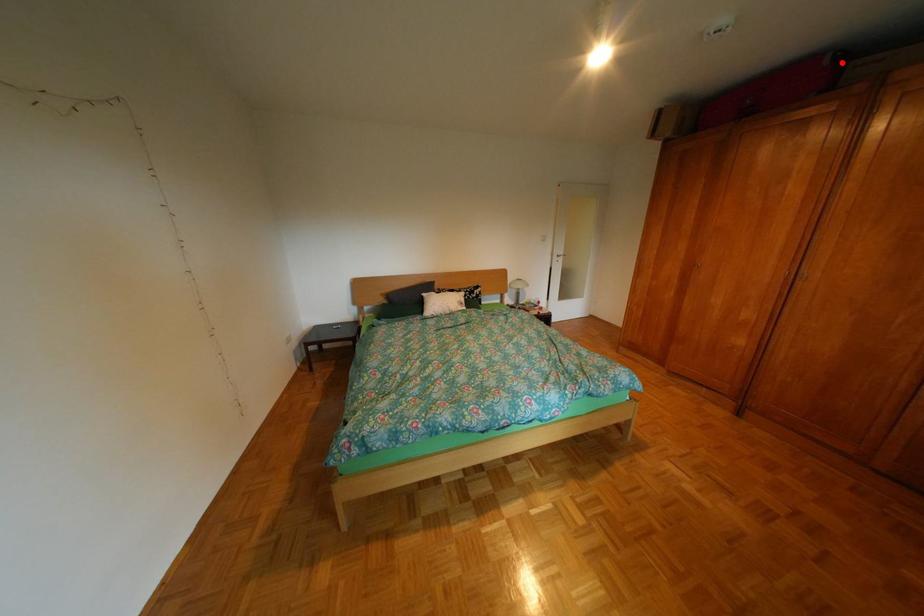
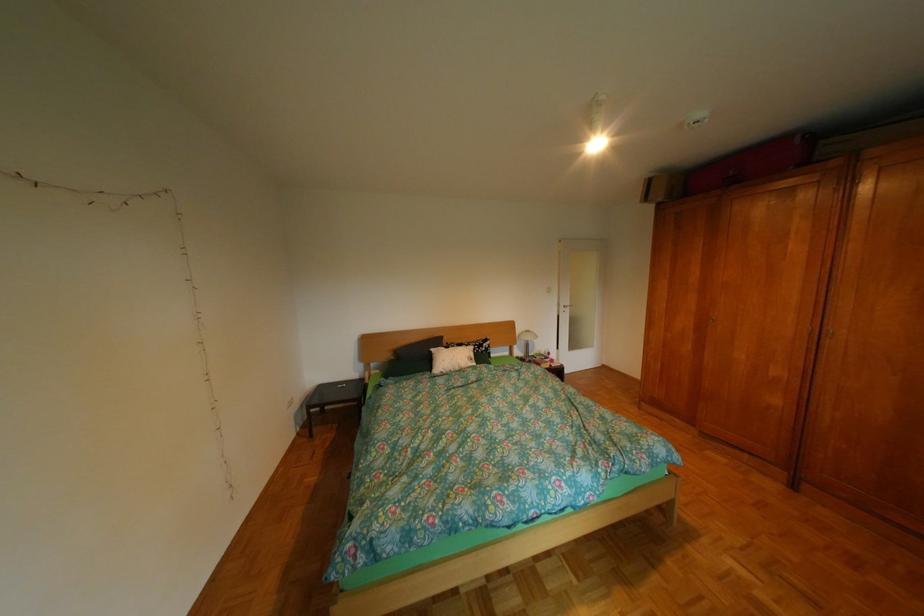
Locate, in the second image, the point that corresponds to the highlighted location in the first image.

(812, 142)